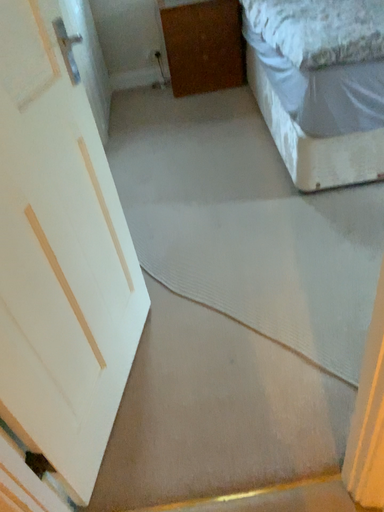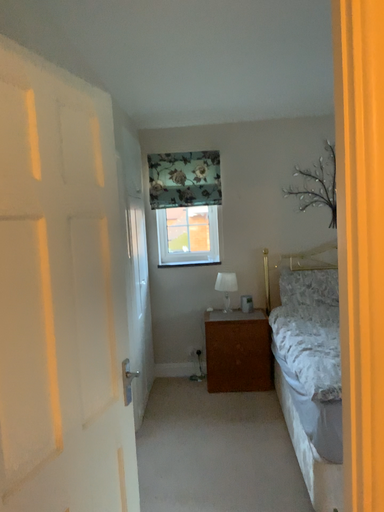
Question: Which way did the camera rotate in the video?

Choices:
 (A) rotated upward
 (B) rotated downward

Answer: (A)